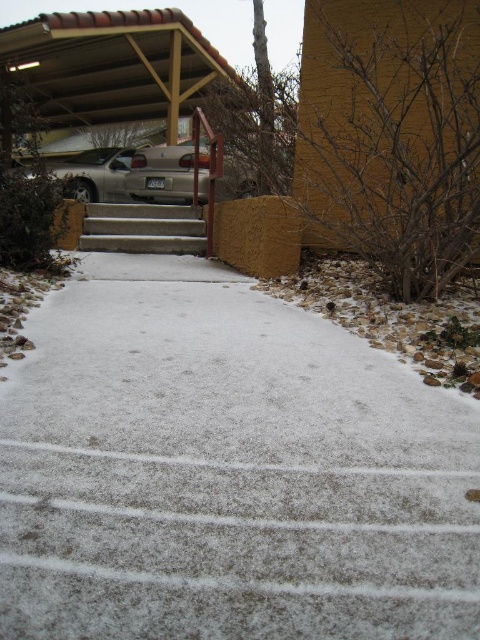
You are standing at the bottom of the white concrete steps at center and want to walk towards the satin silver car at upper left. Which direction should you go?

You should walk towards the satin silver car at upper left, which is located to your upper left direction. Since the white concrete steps at center are closer to you, you can climb them first to get closer to the car.

You are a delivery person trying to park your vehicle in the driveway. You see the silver metallic sedan at center and the satin silver car at upper left. Which car is closer to the right side of the driveway?

The silver metallic sedan at center is closer to the right side of the driveway because it is positioned to the right of the satin silver car at upper left.